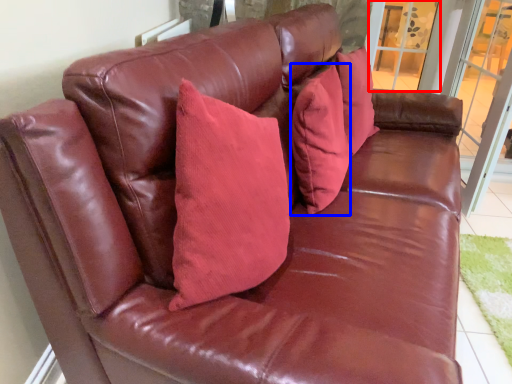
Question: Which point is closer to the camera, window (highlighted by a red box) or pillow (highlighted by a blue box)?

Choices:
 (A) window
 (B) pillow

Answer: (B)